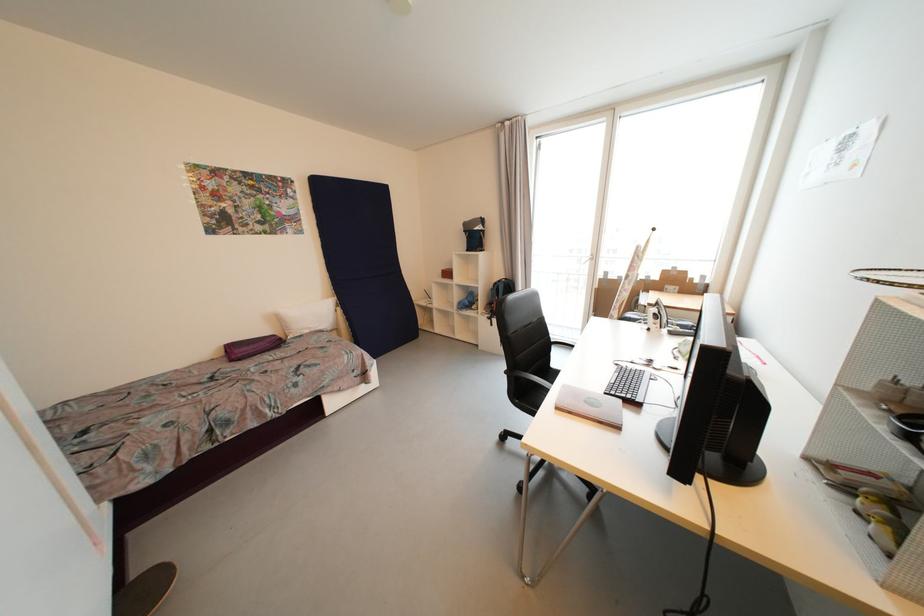
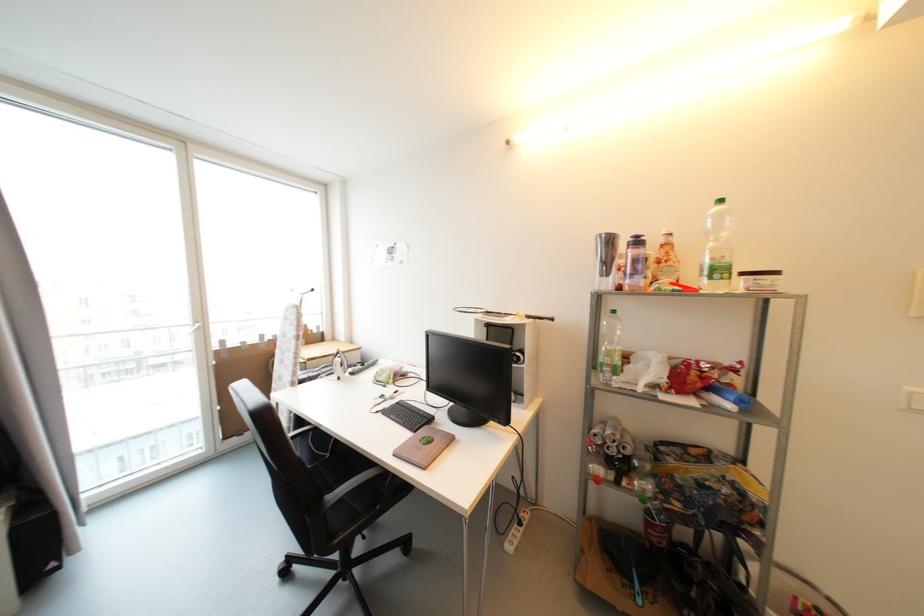
Question: How did the camera likely rotate?

Choices:
 (A) Left
 (B) Right
 (C) Up
 (D) Down

Answer: (B)